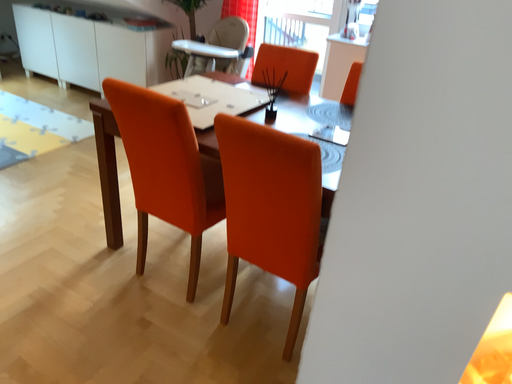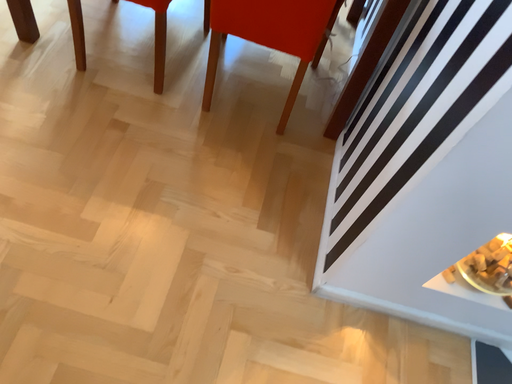
Question: Which way did the camera rotate in the video?

Choices:
 (A) rotated downward
 (B) rotated upward

Answer: (A)